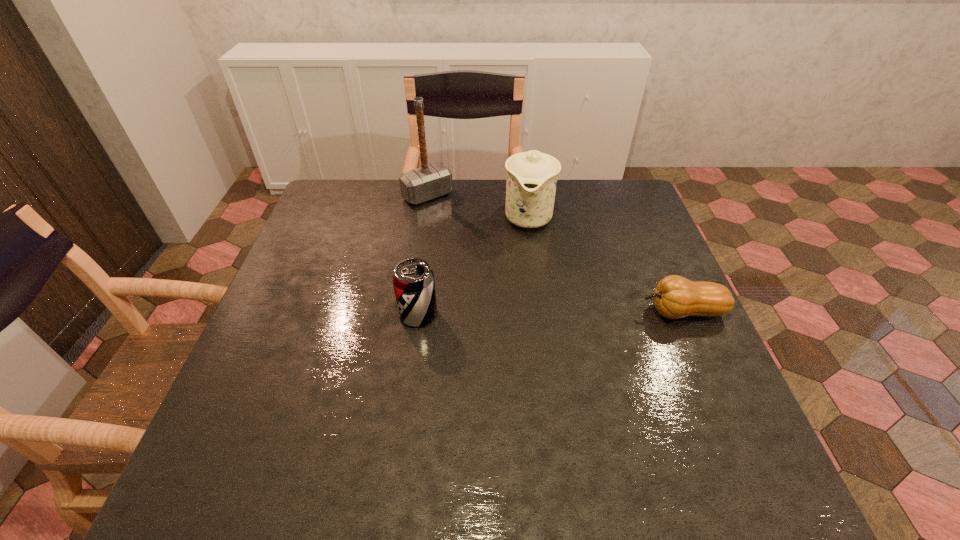
Where is `vacant spot on the desktop that is between the soda can and the shortest object and is positioned on the spout of the third shortest object`? This screenshot has width=960, height=540. vacant spot on the desktop that is between the soda can and the shortest object and is positioned on the spout of the third shortest object is located at coordinates (516, 313).

The width and height of the screenshot is (960, 540). Identify the location of vacant space on the desktop that is between the second shortest object and the gourd and is positioned on the striking surface of the hammer. [542, 313].